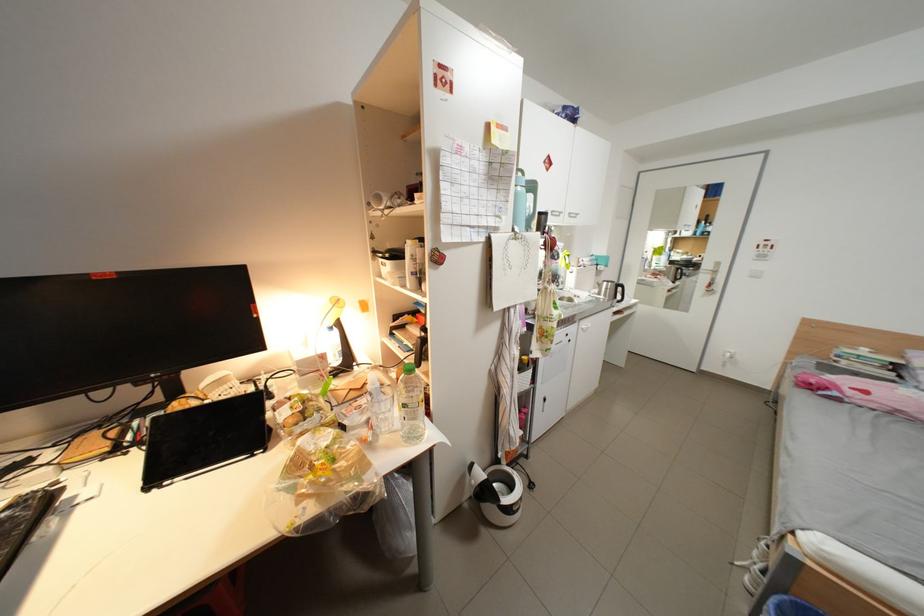
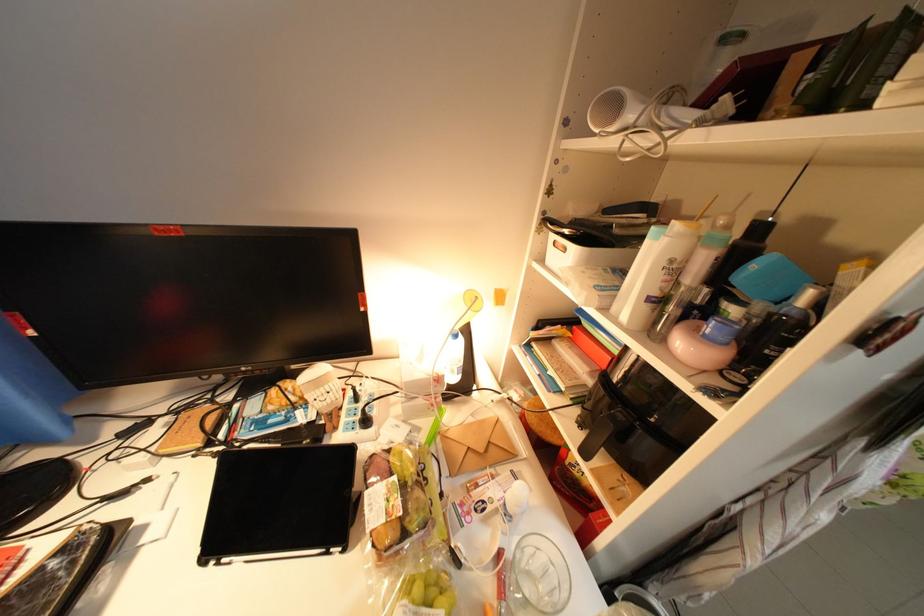
In the second image, find the point that corresponds to (410,207) in the first image.

(713, 124)